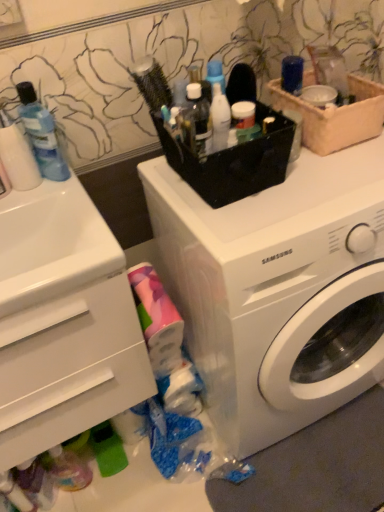
Question: Is the depth of white plastic washing machine at center greater than that of translucent plastic bottle at center, which is counted as the second toiletry, starting from the left?

Choices:
 (A) no
 (B) yes

Answer: (A)

Question: Is white plastic washing machine at center in contact with translucent plastic bottle at center, which is counted as the second toiletry, starting from the left?

Choices:
 (A) yes
 (B) no

Answer: (B)

Question: Does white plastic washing machine at center appear on the right side of translucent plastic bottle at center, which is counted as the second toiletry, starting from the left?

Choices:
 (A) no
 (B) yes

Answer: (B)

Question: From the image's perspective, is white plastic washing machine at center below translucent plastic bottle at center, which is counted as the second toiletry, starting from the left?

Choices:
 (A) no
 (B) yes

Answer: (B)

Question: From a real-world perspective, is white plastic washing machine at center over translucent plastic bottle at center, the 1th toiletry in the right-to-left sequence?

Choices:
 (A) no
 (B) yes

Answer: (A)

Question: In terms of width, does translucent plastic bottle at center, the 1th toiletry in the right-to-left sequence, look wider or thinner when compared to white glossy sink at left?

Choices:
 (A) wide
 (B) thin

Answer: (B)

Question: From their relative heights in the image, would you say translucent plastic bottle at center, which is counted as the second toiletry, starting from the left, is taller or shorter than white glossy sink at left?

Choices:
 (A) tall
 (B) short

Answer: (A)

Question: From the image's perspective, is translucent plastic bottle at center, which is counted as the second toiletry, starting from the left, above or below white glossy sink at left?

Choices:
 (A) above
 (B) below

Answer: (A)

Question: Is translucent plastic bottle at center, which is counted as the second toiletry, starting from the left, bigger or smaller than white glossy sink at left?

Choices:
 (A) big
 (B) small

Answer: (B)

Question: In terms of width, does translucent plastic bottle at center, the 1th toiletry in the right-to-left sequence, look wider or thinner when compared to white plastic washing machine at center?

Choices:
 (A) thin
 (B) wide

Answer: (A)

Question: Considering the relative positions of translucent plastic bottle at center, the 1th toiletry in the right-to-left sequence, and white plastic washing machine at center in the image provided, is translucent plastic bottle at center, the 1th toiletry in the right-to-left sequence, to the left or to the right of white plastic washing machine at center?

Choices:
 (A) right
 (B) left

Answer: (B)

Question: From a real-world perspective, is translucent plastic bottle at center, the 1th toiletry in the right-to-left sequence, above or below white plastic washing machine at center?

Choices:
 (A) below
 (B) above

Answer: (B)

Question: Is translucent plastic bottle at center, which is counted as the second toiletry, starting from the left, in front of or behind white plastic washing machine at center in the image?

Choices:
 (A) front
 (B) behind

Answer: (B)

Question: From a real-world perspective, is white plastic drawer at lower left above or below white plastic washing machine at center?

Choices:
 (A) above
 (B) below

Answer: (A)

Question: From the image's perspective, is white plastic drawer at lower left located above or below white plastic washing machine at center?

Choices:
 (A) above
 (B) below

Answer: (B)